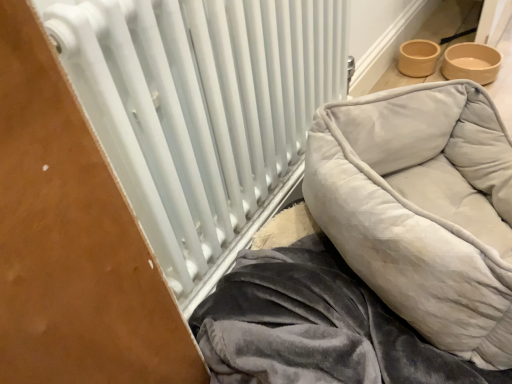
The height and width of the screenshot is (384, 512). What do you see at coordinates (422, 209) in the screenshot?
I see `velvet gray pet bed at right` at bounding box center [422, 209].

Locate an element on the screen. This screenshot has width=512, height=384. velvet gray pet bed at right is located at coordinates (422, 209).

Describe the element at coordinates (203, 113) in the screenshot. I see `white metallic radiator at center` at that location.

Locate an element on the screen. This screenshot has width=512, height=384. white metallic radiator at center is located at coordinates (203, 113).

This screenshot has height=384, width=512. Find the location of `velvet gray pet bed at right`. velvet gray pet bed at right is located at coordinates tap(422, 209).

Can you confirm if white metallic radiator at center is positioned to the right of velvet gray pet bed at right?

No, white metallic radiator at center is not to the right of velvet gray pet bed at right.

Which object is closer to the camera taking this photo, white metallic radiator at center or velvet gray pet bed at right?

white metallic radiator at center is in front.

Between point (292, 84) and point (426, 282), which one is positioned behind?

The point (292, 84) is behind.

From the image's perspective, between white metallic radiator at center and velvet gray pet bed at right, which one is located above?

white metallic radiator at center is shown above in the image.

From a real-world perspective, does white metallic radiator at center stand above velvet gray pet bed at right?

Indeed, from a real-world perspective, white metallic radiator at center stands above velvet gray pet bed at right.

In the scene shown: Considering the relative sizes of white metallic radiator at center and velvet gray pet bed at right in the image provided, is white metallic radiator at center wider than velvet gray pet bed at right?

Incorrect, the width of white metallic radiator at center does not surpass that of velvet gray pet bed at right.

Considering the sizes of objects white metallic radiator at center and velvet gray pet bed at right in the image provided, who is taller, white metallic radiator at center or velvet gray pet bed at right?

Standing taller between the two is white metallic radiator at center.

Looking at the image, does white metallic radiator at center seem bigger or smaller compared to velvet gray pet bed at right?

Considering their sizes, white metallic radiator at center takes up less space than velvet gray pet bed at right.

Would you say white metallic radiator at center is outside velvet gray pet bed at right?

That's correct, white metallic radiator at center is outside of velvet gray pet bed at right.

Looking at this image, are white metallic radiator at center and velvet gray pet bed at right beside each other?

No, white metallic radiator at center is not beside velvet gray pet bed at right.

Is white metallic radiator at center facing towards velvet gray pet bed at right?

Yes, white metallic radiator at center faces towards velvet gray pet bed at right.

How many degrees apart are the facing directions of white metallic radiator at center and velvet gray pet bed at right?

They differ by 65.9 degrees in their facing directions.

How distant is white metallic radiator at center from velvet gray pet bed at right?

A distance of 11.22 inches exists between white metallic radiator at center and velvet gray pet bed at right.

Where is `furniture located on the right of white metallic radiator at center`? The height and width of the screenshot is (384, 512). furniture located on the right of white metallic radiator at center is located at coordinates (422, 209).

Between velvet gray pet bed at right and white metallic radiator at center, which one appears on the left side from the viewer's perspective?

Positioned to the left is white metallic radiator at center.

Considering the positions of objects velvet gray pet bed at right and white metallic radiator at center in the image provided, who is in front, velvet gray pet bed at right or white metallic radiator at center?

white metallic radiator at center.

Which is nearer, (434, 196) or (180, 177)?

Clearly, point (434, 196) is more distant from the camera than point (180, 177).

From the image's perspective, is velvet gray pet bed at right on white metallic radiator at center?

No.

In the scene shown: From a real-world perspective, is velvet gray pet bed at right physically located above or below white metallic radiator at center?

Clearly, from a real-world perspective, velvet gray pet bed at right is below white metallic radiator at center.

Considering the sizes of objects velvet gray pet bed at right and white metallic radiator at center in the image provided, who is wider, velvet gray pet bed at right or white metallic radiator at center?

Wider between the two is velvet gray pet bed at right.

From their relative heights in the image, would you say velvet gray pet bed at right is taller or shorter than white metallic radiator at center?

Considering their sizes, velvet gray pet bed at right has less height than white metallic radiator at center.

Based on the photo, is velvet gray pet bed at right bigger or smaller than white metallic radiator at center?

Clearly, velvet gray pet bed at right is larger in size than white metallic radiator at center.

Looking at this image, is velvet gray pet bed at right spatially inside white metallic radiator at center, or outside of it?

velvet gray pet bed at right exists outside the volume of white metallic radiator at center.

Is velvet gray pet bed at right placed right next to white metallic radiator at center?

velvet gray pet bed at right and white metallic radiator at center are clearly separated.

Is velvet gray pet bed at right facing away from white metallic radiator at center?

No, velvet gray pet bed at right's orientation is not away from white metallic radiator at center.

Identify the location of radiator on the left of velvet gray pet bed at right. (203, 113).

Where is `radiator on the left of velvet gray pet bed at right`? radiator on the left of velvet gray pet bed at right is located at coordinates (203, 113).

In order to click on furniture that appears below the white metallic radiator at center (from a real-world perspective) in this screenshot , I will do `click(422, 209)`.